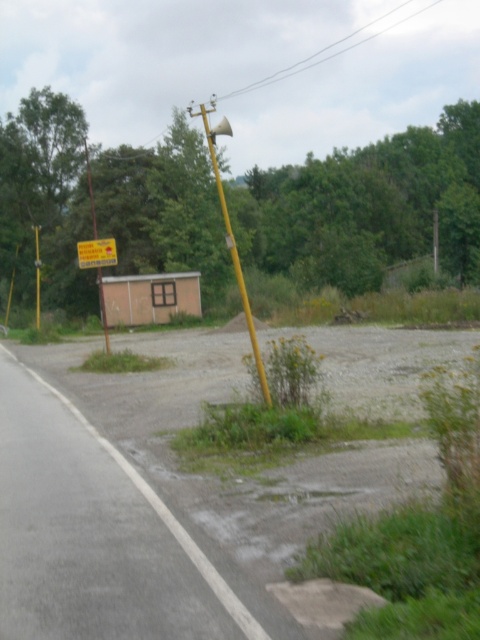
This screenshot has height=640, width=480. What do you see at coordinates (232, 237) in the screenshot?
I see `yellow matte pole at center` at bounding box center [232, 237].

Between point (227, 236) and point (109, 240), which one is positioned behind?

Positioned behind is point (227, 236).

Locate an element on the screen. Image resolution: width=480 pixels, height=640 pixels. yellow matte pole at center is located at coordinates (232, 237).

Who is more forward, (238, 260) or (96, 228)?

Point (238, 260) is more forward.

Is yellow matte pole at center below yellow matte sign at left?

No, yellow matte pole at center is not below yellow matte sign at left.

Between point (266, 401) and point (88, 170), which one is positioned in front?

Point (266, 401) is in front.

This screenshot has width=480, height=640. I want to click on yellow matte pole at center, so click(x=232, y=237).

Is yellow plastic sign at center positioned at the back of yellow matte sign at left?

Yes.

Is yellow plastic sign at center above yellow matte sign at left?

Incorrect, yellow plastic sign at center is not positioned above yellow matte sign at left.

The height and width of the screenshot is (640, 480). What do you see at coordinates (96, 252) in the screenshot?
I see `yellow plastic sign at center` at bounding box center [96, 252].

Identify the location of yellow plastic sign at center. (96, 252).